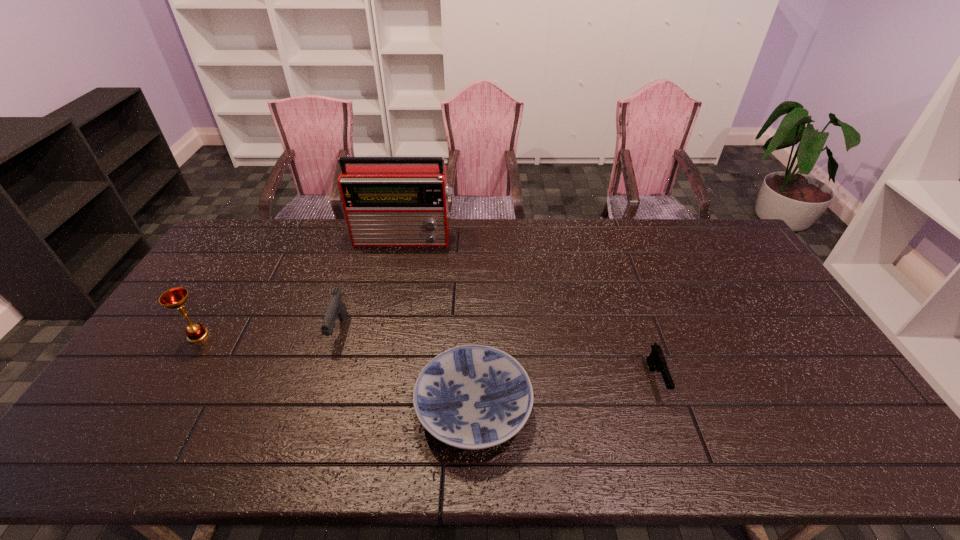
The width and height of the screenshot is (960, 540). In order to click on vacant space at the right edge in this screenshot , I will do `click(797, 350)`.

Find the location of `free space at the far left corner of the desktop`. free space at the far left corner of the desktop is located at coordinates (234, 232).

Where is `free space at the near left corner`? This screenshot has width=960, height=540. free space at the near left corner is located at coordinates (128, 457).

Find the location of a particular element. This screenshot has height=540, width=960. blank region between the tallest object and the chalice is located at coordinates (301, 286).

You are a GUI agent. You are given a task and a screenshot of the screen. Output one action in this format:
    pyautogui.click(x=<x>, y=<y>)
    Task: Click on the free space between the farthest object and the left pistol
    Image resolution: width=960 pixels, height=540 pixels.
    Given the screenshot: What is the action you would take?
    pyautogui.click(x=372, y=284)

Image resolution: width=960 pixels, height=540 pixels. In order to click on vacant area that lies between the farthest object and the nearer pistol in this screenshot , I will do `click(531, 308)`.

Where is `vacant space that's between the third shortest object and the plate`? vacant space that's between the third shortest object and the plate is located at coordinates (406, 369).

You are a GUI agent. You are given a task and a screenshot of the screen. Output one action in this format:
    pyautogui.click(x=<x>, y=<y>)
    Task: Click on the free point between the plate and the third tallest object
    Image resolution: width=960 pixels, height=540 pixels.
    Given the screenshot: What is the action you would take?
    pyautogui.click(x=406, y=369)

Where is `vacant area that lies between the farthest object and the right pistol`? vacant area that lies between the farthest object and the right pistol is located at coordinates (531, 308).

The height and width of the screenshot is (540, 960). In order to click on empty space between the taller pistol and the plate in this screenshot , I will do `click(406, 369)`.